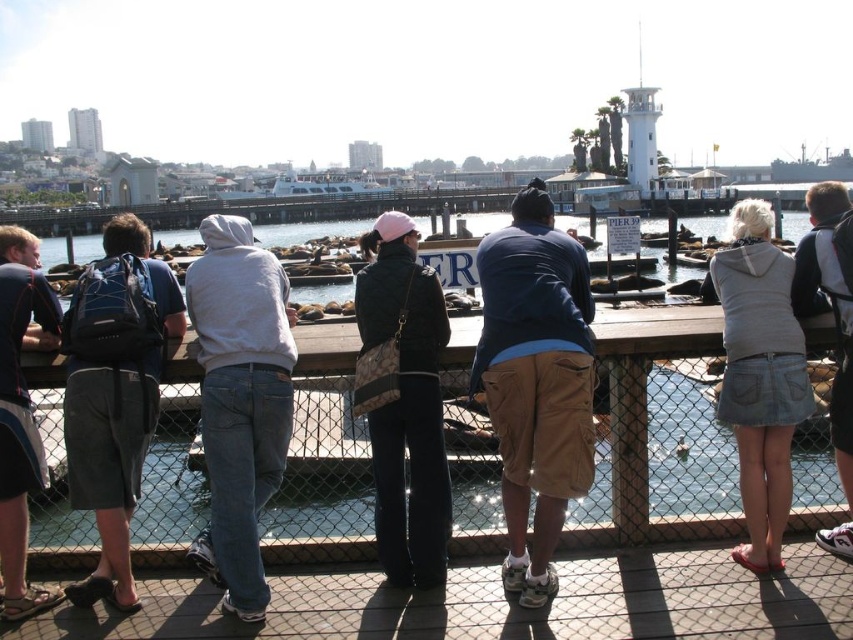
In the scene shown: You are a photographer at Pier 39 and want to capture both the blue cotton hoodie at center and the light gray hoodie at center in the same frame. Which hoodie should you focus on first to ensure both are in the shot?

The blue cotton hoodie at center is positioned on the right side of light gray hoodie at center, so you should focus on the light gray hoodie at center first to ensure both are in the shot.

You are a photographer at Pier 39 trying to capture a clear shot of the sea lions. You notice the denim skirt at lower right and the brushed metal backpack at left are blocking your view. Which object is closer to you, requiring you to move it first to get an unobstructed view?

The denim skirt at lower right is positioned over the brushed metal backpack at left, meaning the denim skirt is closer to you. To get an unobstructed view, you should move the denim skirt at lower right first.